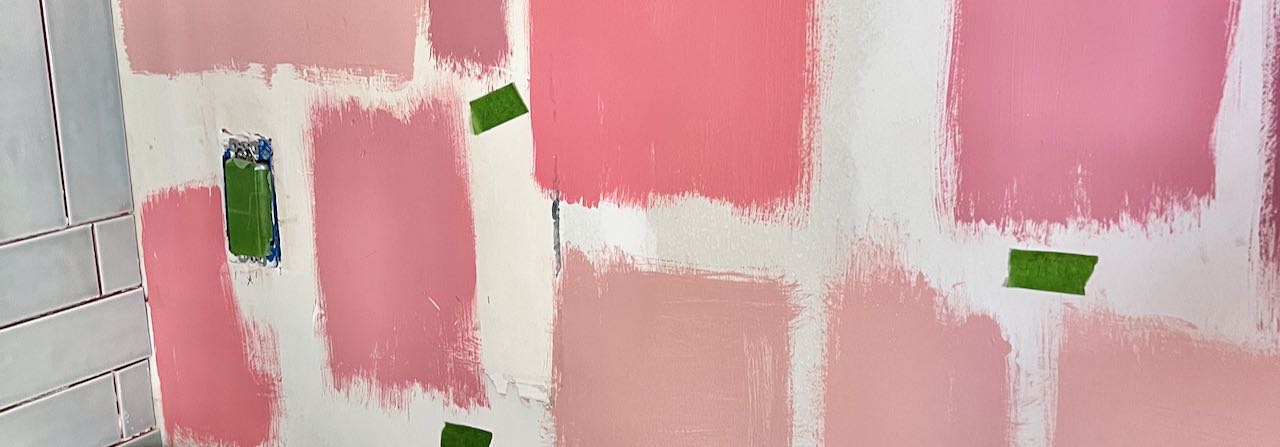
This screenshot has width=1280, height=447. In order to click on wall in this screenshot , I will do `click(696, 155)`.